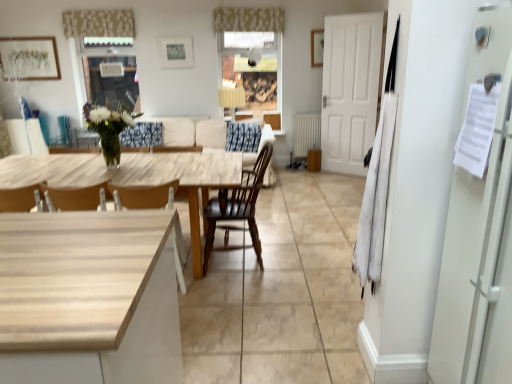
Question: From a real-world perspective, is light wood table at center positioned above or below beige textured curtain at upper center, placed as the second curtain when sorted from right to left?

Choices:
 (A) above
 (B) below

Answer: (B)

Question: In terms of width, does light wood table at center look wider or thinner when compared to beige textured curtain at upper center, placed as the second curtain when sorted from right to left?

Choices:
 (A) wide
 (B) thin

Answer: (A)

Question: Based on their relative distances, which object is nearer to the metallic silver picture frame at upper center, which is counted as the 2th picture frame, starting from the left?

Choices:
 (A) matte wooden picture frame at upper center, which is counted as the third picture frame, starting from the left
 (B) beige floral fabric valance at upper center, positioned as the 2th curtain in left-to-right order
 (C) beige textured curtain at upper center, placed as the second curtain when sorted from right to left
 (D) light wood table at center
 (E) matte wood cabinet at center

Answer: (B)

Question: Considering the real-world distances, which object is closest to the wooden chair at center, the second chair from the right?

Choices:
 (A) beige fabric couch at center
 (B) metallic silver picture frame at upper center, which is counted as the 2th picture frame, starting from the left
 (C) dark brown wood chair at center, which is counted as the first chair, starting from the right
 (D) matte wooden picture frame at upper center, the first picture frame positioned from the right
 (E) beige textured curtain at upper center, placed as the second curtain when sorted from right to left

Answer: (C)